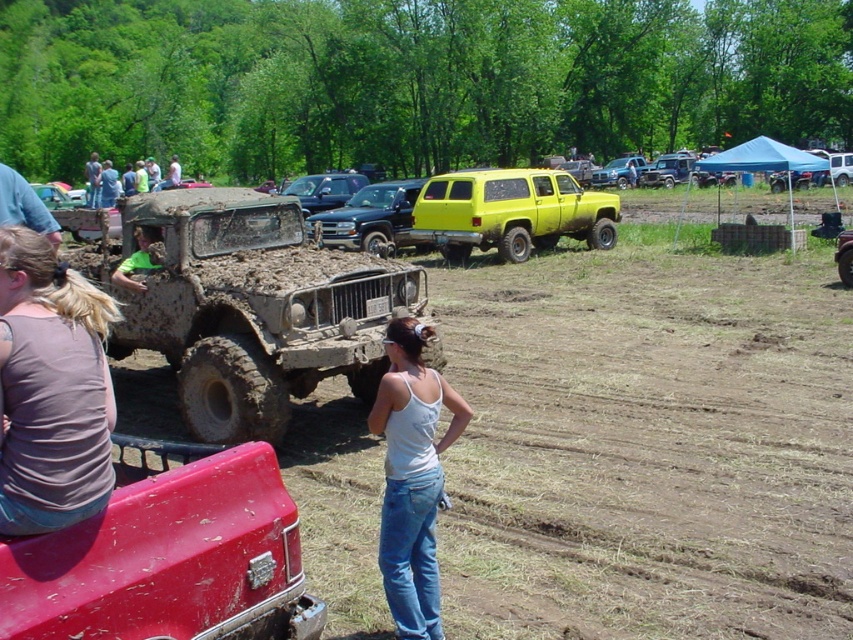
You are a photographer at the mud bogging event and want to capture a photo of the muddy rubber truck at left and the yellow matte suv at center. Which vehicle should you focus on if you want to emphasize the larger vehicle in your composition?

The muddy rubber truck at left is larger in size compared to the yellow matte suv at center, so you should focus on the muddy rubber truck at left to emphasize the larger vehicle in your composition.

You are a photographer at the mud bogging event. You want to take a photo of the white cotton tank top at center and the yellow matte suv at center. Which object should you focus on first to ensure both are in focus?

The white cotton tank top at center is closer to the viewer than the yellow matte suv at center. To ensure both are in focus, focus on the white cotton tank top at center first, as it is closer, and the SUV will be in focus as well if the depth of field is sufficient.

You are standing at the event and want to take a photo of the muddy rubber truck at left. If your camera has a maximum focus range of 6 meters, will you be able to capture the truck clearly?

The muddy rubber truck at left is 6.82 meters away from the viewer. Since the camera can only focus up to 6 meters, it won me be able to capture the truck clearly.